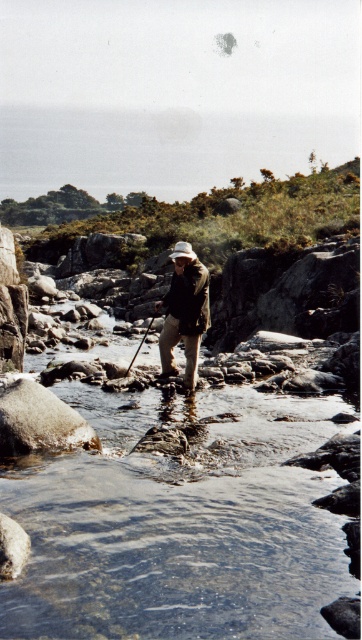
Question: Estimate the real-world distances between objects in this image. Which object is farther from the clear water at center?

Choices:
 (A) wooden fishing pole at center
 (B) camouflage jacket at center

Answer: (A)

Question: Can you confirm if camouflage jacket at center is bigger than wooden fishing pole at center?

Choices:
 (A) yes
 (B) no

Answer: (B)

Question: Which point appears closest to the camera in this image?

Choices:
 (A) (140, 342)
 (B) (170, 289)

Answer: (B)

Question: Is clear water at center to the left of camouflage jacket at center from the viewer's perspective?

Choices:
 (A) no
 (B) yes

Answer: (A)

Question: Is clear water at center positioned at the back of camouflage jacket at center?

Choices:
 (A) yes
 (B) no

Answer: (B)

Question: Which point is farther to the camera?

Choices:
 (A) (x=68, y=573)
 (B) (x=144, y=340)
 (C) (x=200, y=308)

Answer: (B)